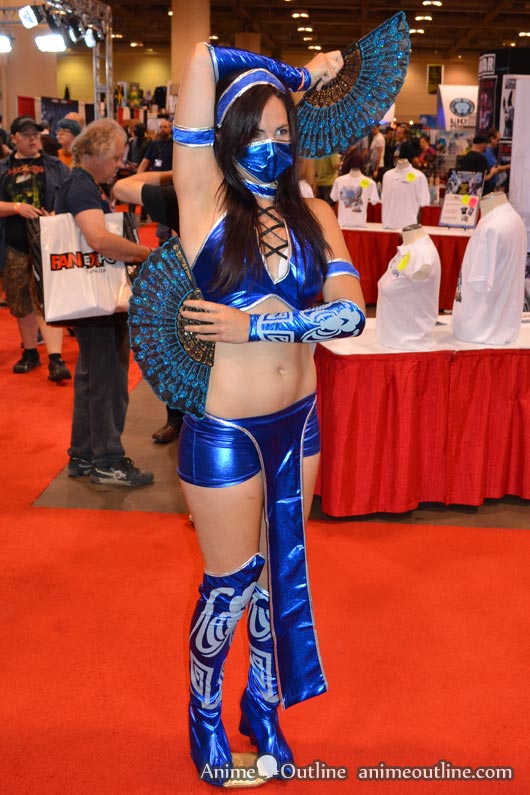
Find the location of a particular element. fans is located at coordinates (165, 332), (349, 117).